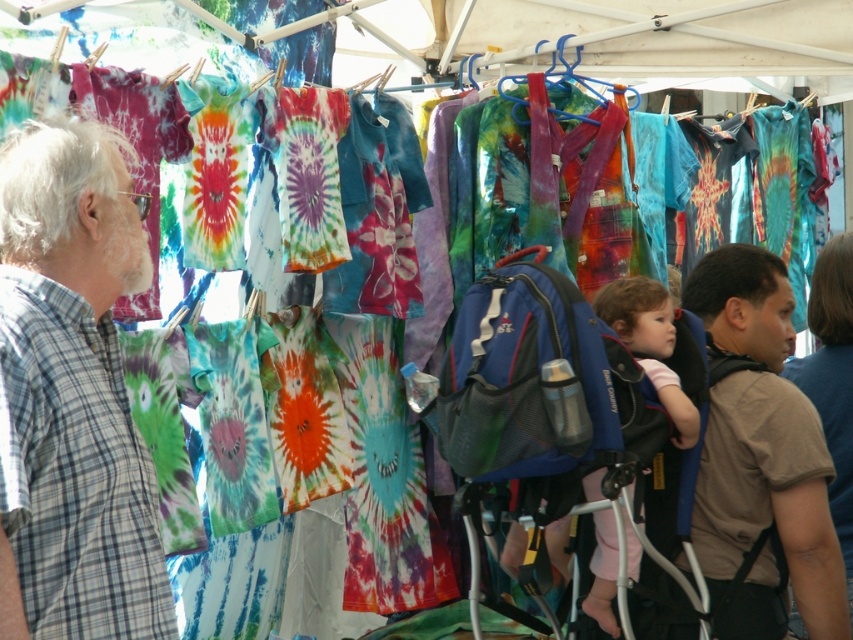
Question: Observing the image, what is the correct spatial positioning of brown cotton t-shirt at center-right in reference to pink fabric at center?

Choices:
 (A) above
 (B) below

Answer: (B)

Question: Among these objects, which one is nearest to the camera?

Choices:
 (A) plaid shirt at left
 (B) brown cotton t-shirt at center-right

Answer: (A)

Question: Among these objects, which one is nearest to the camera?

Choices:
 (A) plaid shirt at left
 (B) brown cotton t-shirt at center-right

Answer: (A)

Question: Can you confirm if plaid shirt at left is positioned to the left of pink fabric at center?

Choices:
 (A) no
 (B) yes

Answer: (B)

Question: Does brown cotton t-shirt at center-right have a larger size compared to pink fabric at center?

Choices:
 (A) no
 (B) yes

Answer: (B)

Question: Considering the real-world distances, which object is farthest from the plaid shirt at left?

Choices:
 (A) pink fabric at center
 (B) brown cotton t-shirt at center-right

Answer: (B)